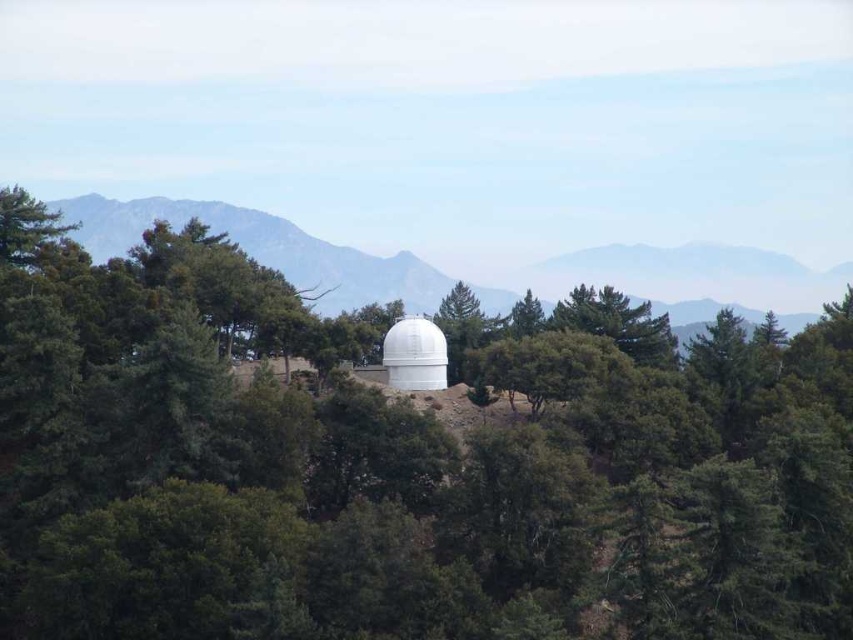
You are standing at the center of the image. Which direction should you move to reach the green matte forest at center?

The green matte forest at center is located at point coordinates (399,465) from the center, so you should move towards the direction of the coordinates to reach it.

You are standing at the base of the white dome observatory in the forest. You see two points marked in the scene. Which point is closer to you, point (734, 499) or point (202, 212)?

Point (734, 499) is closer to the viewer than point (202, 212).

You are standing at the entrance of the white dome observatory and notice a specific point marked on your map. The coordinates of this point are point (x=399, y=465). According to the image, what does this point indicate?

The point (x=399, y=465) marks the green matte forest at center.